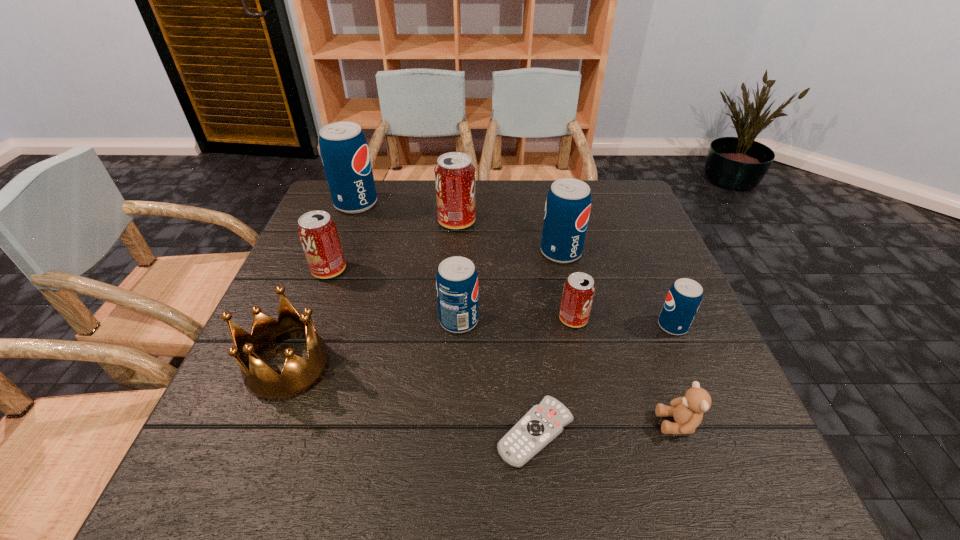
This screenshot has width=960, height=540. What are the coordinates of `crown located in the left edge section of the desktop` in the screenshot? It's located at (299, 375).

In order to click on pop that is at the right edge in this screenshot , I will do `click(684, 297)`.

This screenshot has height=540, width=960. In order to click on teddy bear located at the right edge in this screenshot , I will do `click(687, 411)`.

Where is `object located at the far left corner`? The height and width of the screenshot is (540, 960). object located at the far left corner is located at coordinates (344, 150).

In the image, there is a desktop. Find the location of `blank space at the far edge`. blank space at the far edge is located at coordinates (492, 186).

This screenshot has width=960, height=540. I want to click on vacant area at the right edge of the desktop, so click(x=655, y=295).

In order to click on free space at the far left corner of the desktop in this screenshot , I will do `click(328, 198)`.

Identify the location of blank space at the far right corner of the desktop. The width and height of the screenshot is (960, 540). (591, 183).

Where is `vacant space that's between the tallest pop and the second smallest red soda can`? This screenshot has width=960, height=540. vacant space that's between the tallest pop and the second smallest red soda can is located at coordinates (343, 237).

You are a GUI agent. You are given a task and a screenshot of the screen. Output one action in this format:
    pyautogui.click(x=<x>, y=<y>)
    Task: Click on the vacant area between the rightmost red soda can and the third blue pop from right to left
    This screenshot has width=960, height=540.
    Given the screenshot: What is the action you would take?
    pyautogui.click(x=516, y=320)